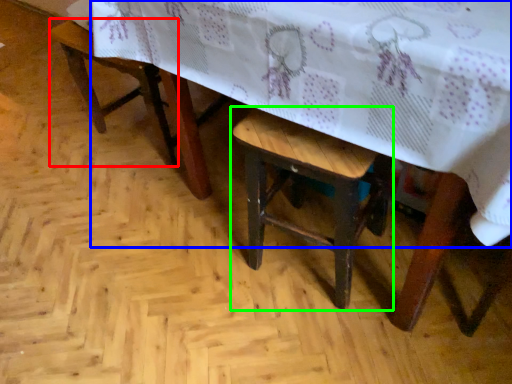
Question: Considering the real-world distances, which object is closest to armchair (highlighted by a red box)? table (highlighted by a blue box) or stool (highlighted by a green box).

Choices:
 (A) table
 (B) stool

Answer: (A)